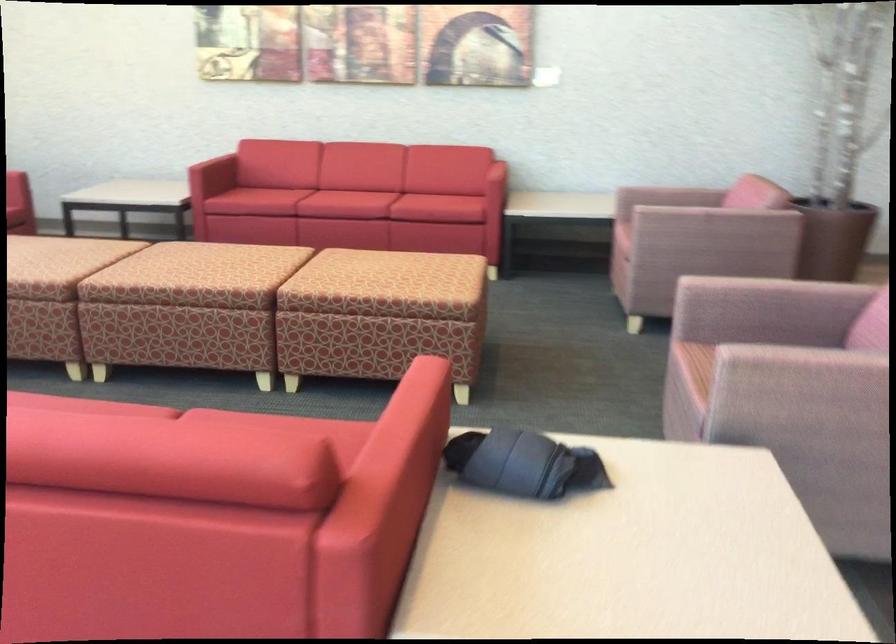
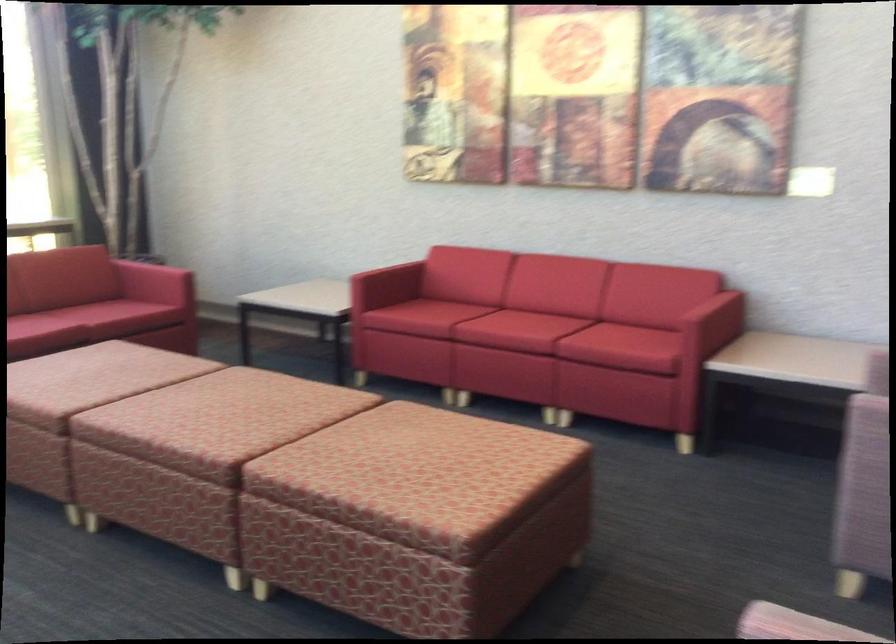
What movement of the cameraman would produce the second image?

The movement direction of the cameraman is right, forward.